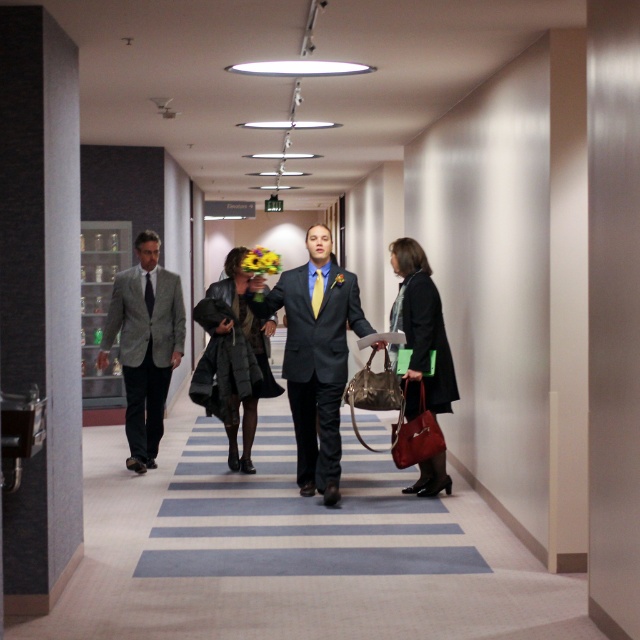
Question: Is the position of matte black suit at center more distant than that of gray wool suit at center?

Choices:
 (A) yes
 (B) no

Answer: (B)

Question: Observing the image, what is the correct spatial positioning of gray wool suit at center in reference to leather coat at center?

Choices:
 (A) left
 (B) right

Answer: (A)

Question: Can you confirm if gray wool suit at center is wider than leather jacket at right?

Choices:
 (A) yes
 (B) no

Answer: (A)

Question: Which point is closer to the camera taking this photo?

Choices:
 (A) (129, 392)
 (B) (323, 486)

Answer: (B)

Question: Which object appears farthest from the camera in this image?

Choices:
 (A) leather jacket at right
 (B) gray wool suit at center
 (C) matte black suit at center

Answer: (B)

Question: Among these objects, which one is farthest from the camera?

Choices:
 (A) gray wool suit at center
 (B) leather coat at center
 (C) matte black suit at center
 (D) leather jacket at right

Answer: (A)